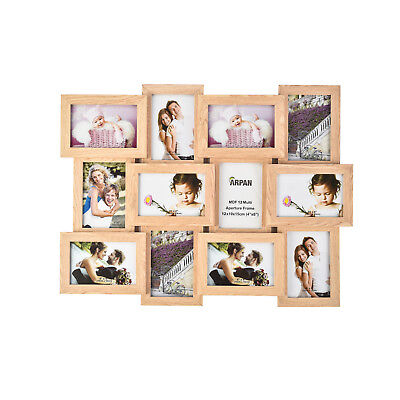
The image size is (400, 400). Find the location of `vertical frame`. vertical frame is located at coordinates (165, 252), (110, 199), (234, 193), (304, 116), (184, 124), (290, 285).